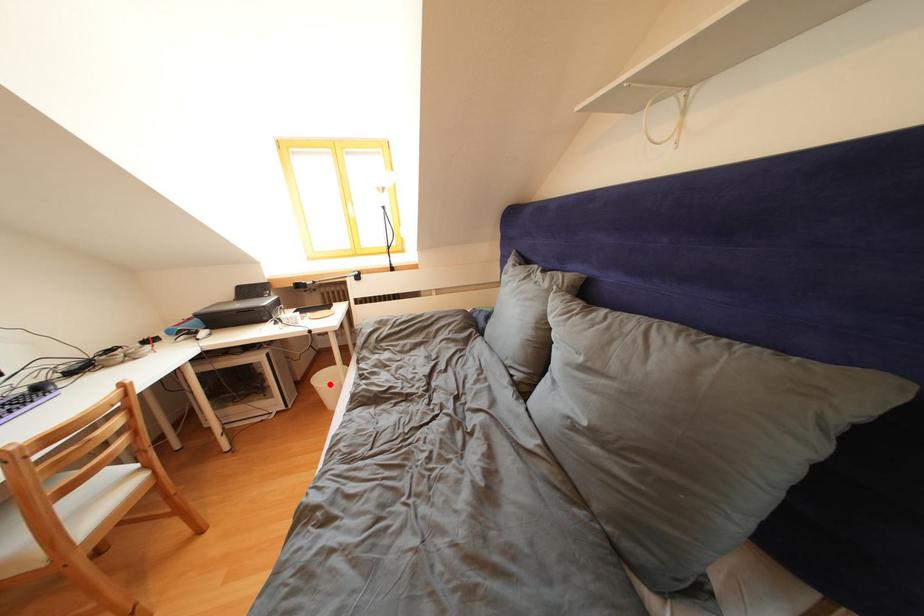
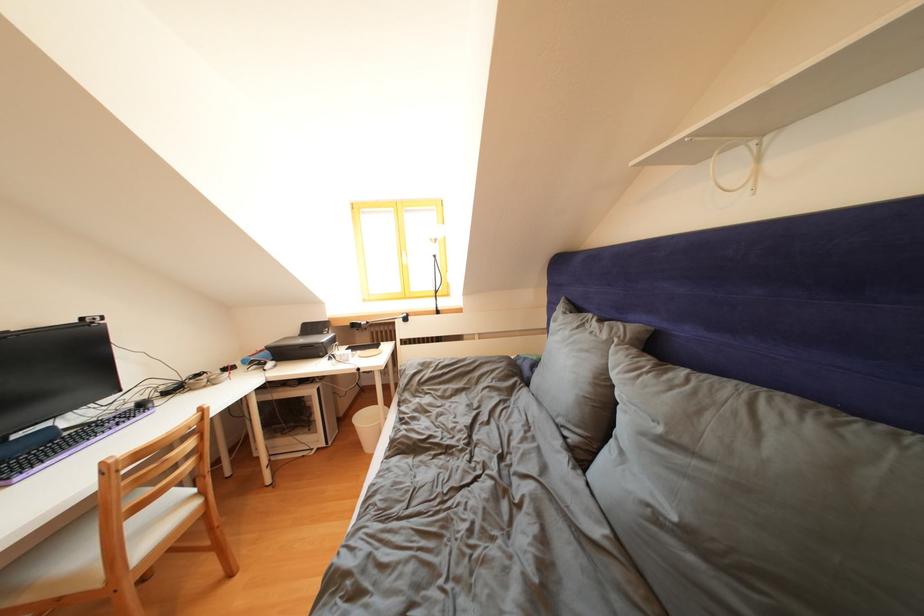
In the second image, find the point that corresponds to the highlighted location in the first image.

(371, 424)